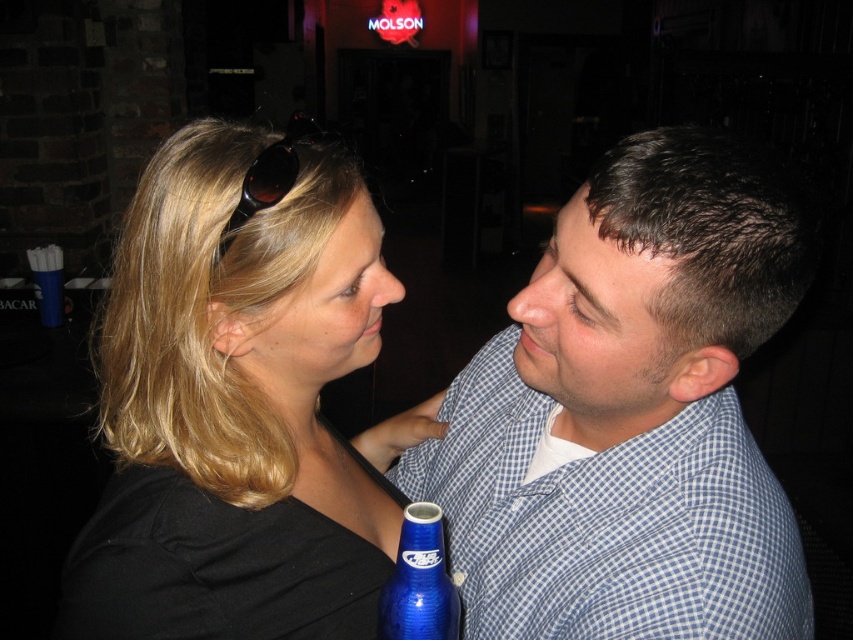
Question: Based on their relative distances, which object is nearer to the blue glass bottle at lower center?

Choices:
 (A) black plastic sunglasses at upper center
 (B) dark brown hair at upper center

Answer: (B)

Question: Can you confirm if blue glass bottle at lower center is wider than matte blonde hair at center?

Choices:
 (A) yes
 (B) no

Answer: (A)

Question: Estimate the real-world distances between objects in this image. Which object is closer to the blue glass bottle at lower center?

Choices:
 (A) matte blonde hair at center
 (B) dark brown hair at upper center
 (C) blue checkered shirt at right
 (D) black plastic sunglasses at upper center

Answer: (B)

Question: Is black matte hair at center further to the viewer compared to blue glass bottle at lower center?

Choices:
 (A) yes
 (B) no

Answer: (A)

Question: Based on their relative distances, which object is nearer to the black plastic sunglasses at upper center?

Choices:
 (A) blue checkered shirt at right
 (B) black matte hair at center
 (C) matte blonde hair at center
 (D) blue glass bottle at lower center

Answer: (B)

Question: Considering the relative positions of blue checkered shirt at right and dark brown hair at upper center in the image provided, where is blue checkered shirt at right located with respect to dark brown hair at upper center?

Choices:
 (A) left
 (B) right

Answer: (B)